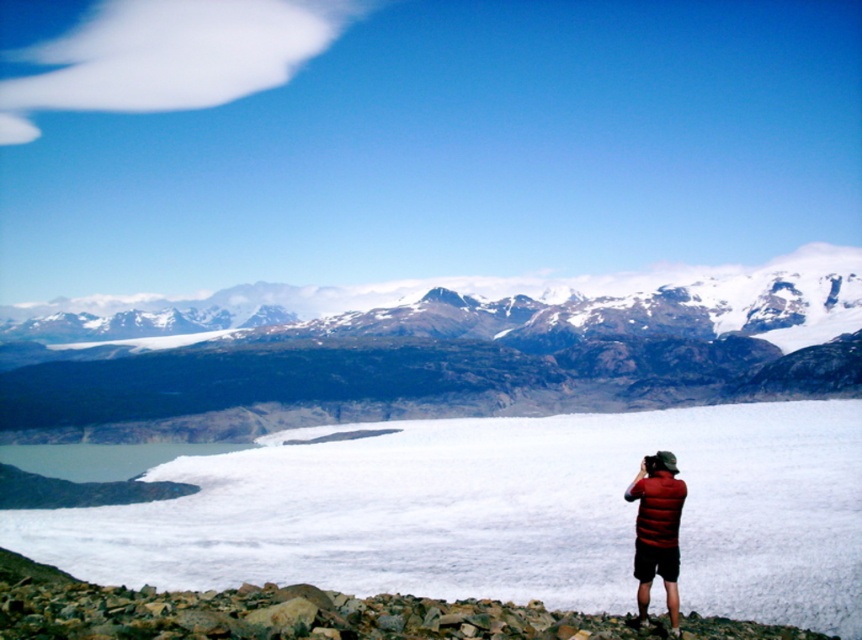
You are a hiker standing at point 0.5, 0.5 in the image. You want to reach the sandy brown rock formation at center. Which direction should you move to get closer to it?

The sandy brown rock formation at center is located at point (461, 362). Since you are at point (431, 320), you should move northeast to reach it.

You are a hiker standing at the point closer to you in the image. You want to reach the point further away. Which of the two points, point (351, 400) or point (673, 550), is the one you need to reach?

Point (673, 550) is further away from you, so you need to reach point (673, 550).